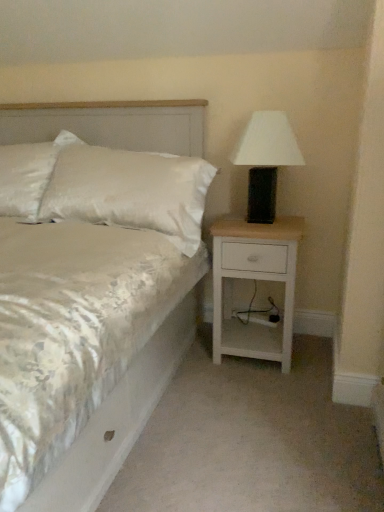
Where is `satin white pillow at upper left`? The height and width of the screenshot is (512, 384). satin white pillow at upper left is located at coordinates (29, 175).

This screenshot has height=512, width=384. Find the location of `white satin bed at center`. white satin bed at center is located at coordinates (92, 289).

Image resolution: width=384 pixels, height=512 pixels. Identify the location of white matte table lamp at right. (266, 160).

From the image's perspective, is satin white pillow at upper left beneath white wood nightstand at right?

Actually, satin white pillow at upper left appears above white wood nightstand at right in the image.

Does point (35, 193) come behind point (244, 265)?

Yes, point (35, 193) is farther from viewer.

Considering the relative sizes of satin white pillow at upper left and white wood nightstand at right in the image provided, is satin white pillow at upper left smaller than white wood nightstand at right?

No.

Is satin white pillow at upper left facing away from white satin bed at center?

That's right, satin white pillow at upper left is facing away from white satin bed at center.

The image size is (384, 512). Identify the location of bed lying on the right of satin white pillow at upper left. (92, 289).

Is satin white pillow at upper left taller or shorter than white satin bed at center?

Clearly, satin white pillow at upper left is shorter compared to white satin bed at center.

From the image's perspective, does white wood nightstand at right appear lower than white satin bed at center?

Yes, from the image's perspective, white wood nightstand at right is below white satin bed at center.

Is white wood nightstand at right far away from white satin bed at center?

No, there isn't a large distance between white wood nightstand at right and white satin bed at center.

In order to click on nightstand below the white satin bed at center (from the image's perspective) in this screenshot , I will do `click(254, 280)`.

Would you say white satin bed at center is part of white matte table lamp at right's contents?

Actually, white satin bed at center is outside white matte table lamp at right.

From a real-world perspective, which is physically below, white matte table lamp at right or white satin bed at center?

white satin bed at center.

Considering the sizes of objects white matte table lamp at right and white satin bed at center in the image provided, who is taller, white matte table lamp at right or white satin bed at center?

With more height is white satin bed at center.

Does point (236, 147) come behind point (126, 232)?

Yes, point (236, 147) is behind point (126, 232).

Is satin white pillow at upper left surrounded by white matte table lamp at right?

No, satin white pillow at upper left is not a part of white matte table lamp at right.

This screenshot has height=512, width=384. I want to click on table lamp in front of the satin white pillow at upper left, so click(266, 160).

Considering the sizes of objects white matte table lamp at right and satin white pillow at upper left in the image provided, who is smaller, white matte table lamp at right or satin white pillow at upper left?

With smaller size is white matte table lamp at right.

Which object is wider, white matte table lamp at right or satin white pillow at upper left?

Wider between the two is satin white pillow at upper left.

Does white wood nightstand at right have a larger size compared to satin white pillow at upper left?

No.

Considering their positions, is white wood nightstand at right located in front of or behind satin white pillow at upper left?

In the image, white wood nightstand at right appears in front of satin white pillow at upper left.

Is white wood nightstand at right situated inside satin white pillow at upper left or outside?

The correct answer is: outside.

Between point (287, 233) and point (13, 207), which one is positioned in front?

The point (287, 233) is closer.

How different are the orientations of white satin bed at center and white matte table lamp at right in degrees?

There is a 0.00416-degree angle between the facing directions of white satin bed at center and white matte table lamp at right.

Would you say white satin bed at center is to the left or to the right of white matte table lamp at right in the picture?

white satin bed at center is positioned on white matte table lamp at right's left side.

Are white satin bed at center and white matte table lamp at right beside each other?

No, white satin bed at center is not touching white matte table lamp at right.

Between white satin bed at center and white matte table lamp at right, which one has larger size?

white satin bed at center.

Identify the location of pillow on the left of white wood nightstand at right. (29, 175).

Where is `bed in front of the satin white pillow at upper left`? This screenshot has height=512, width=384. bed in front of the satin white pillow at upper left is located at coordinates (92, 289).

Estimate the real-world distances between objects in this image. Which object is closer to white satin bed at center, satin white pillow at upper left or white matte table lamp at right?

Based on the image, satin white pillow at upper left appears to be nearer to white satin bed at center.

Looking at this image, which object lies further to the anchor point white wood nightstand at right, white matte table lamp at right or white satin bed at center?

Among the two, white satin bed at center is located further to white wood nightstand at right.

Based on their spatial positions, is white matte table lamp at right or satin white pillow at upper left closer to white wood nightstand at right?

The object closer to white wood nightstand at right is white matte table lamp at right.

Considering their positions, is white wood nightstand at right positioned closer to satin white pillow at upper left than white matte table lamp at right?

white matte table lamp at right lies closer to satin white pillow at upper left than the other object.

From the picture: When comparing their distances from white wood nightstand at right, does satin white pillow at upper left or white matte table lamp at right seem further?

satin white pillow at upper left lies further to white wood nightstand at right than the other object.

Estimate the real-world distances between objects in this image. Which object is further from white satin bed at center, white matte table lamp at right or white wood nightstand at right?

white matte table lamp at right lies further to white satin bed at center than the other object.

In the scene shown: Based on their spatial positions, is white matte table lamp at right or white satin bed at center closer to satin white pillow at upper left?

The object closer to satin white pillow at upper left is white satin bed at center.

Considering their positions, is satin white pillow at upper left positioned further to white matte table lamp at right than white wood nightstand at right?

satin white pillow at upper left is positioned further to the anchor white matte table lamp at right.

This screenshot has height=512, width=384. Identify the location of table lamp between white satin bed at center and white wood nightstand at right in the front-back direction. (266, 160).

Identify the location of nightstand located between white satin bed at center and satin white pillow at upper left in the depth direction. Image resolution: width=384 pixels, height=512 pixels. (254, 280).

Where is `table lamp between satin white pillow at upper left and white wood nightstand at right from left to right`? Image resolution: width=384 pixels, height=512 pixels. table lamp between satin white pillow at upper left and white wood nightstand at right from left to right is located at coordinates (266, 160).

This screenshot has width=384, height=512. Identify the location of table lamp between white satin bed at center and satin white pillow at upper left from front to back. (266, 160).